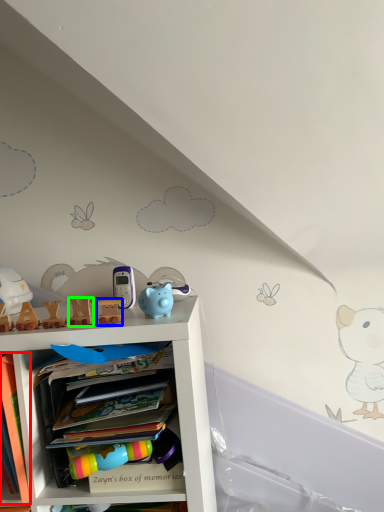
Question: Considering the real-world distances, which object is farthest from book (highlighted by a red box)? toy (highlighted by a blue box) or toy (highlighted by a green box)?

Choices:
 (A) toy
 (B) toy

Answer: (A)